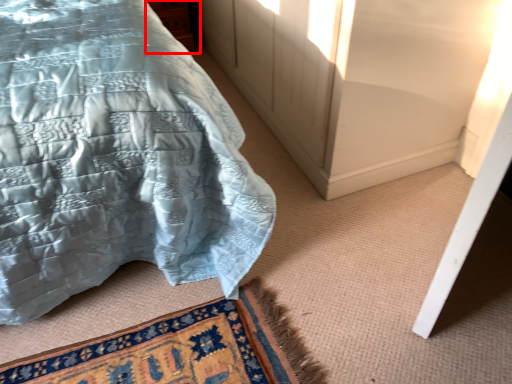
Question: From the image's perspective, where is cabinetry (annotated by the red box) located relative to bed?

Choices:
 (A) below
 (B) above

Answer: (B)